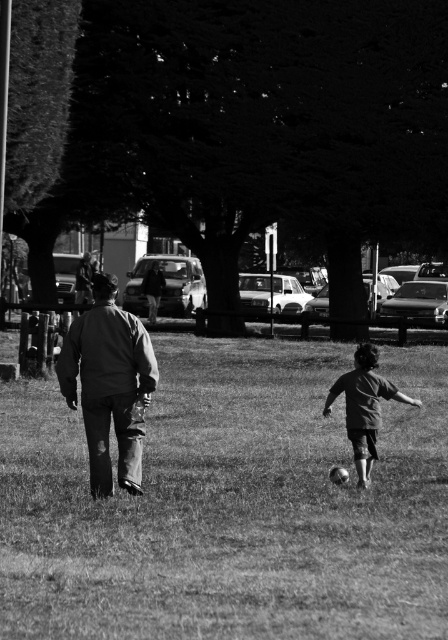
You are standing at point (100, 301) and want to walk to the soccer ball located at point (363, 525). Is there a clear path between these two points?

Yes, there is a clear path between point (100, 301) and point (363, 525) because the point (363, 525) is in front of point (100, 301), indicating no obstruction between them.

In the scene, there is grassy at center and a ripped denim jacket at center. Which object occupies more space in the image?

The grassy at center occupies more space than the ripped denim jacket at center because it has a larger size.